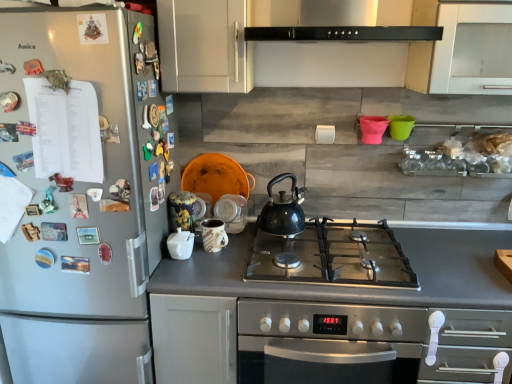
Question: From the image's perspective, is matte ceramic cups at center, the first appliance when ordered from back to front, located above or below white matte cabinet at upper center?

Choices:
 (A) above
 (B) below

Answer: (B)

Question: In the image, is matte ceramic cups at center, the 3th appliance positioned from the front, positioned in front of or behind white matte cabinet at upper center?

Choices:
 (A) behind
 (B) front

Answer: (A)

Question: Which object is positioned farthest from the black matte kettle at center?

Choices:
 (A) matte ceramic cups at center, the 3th appliance positioned from the front
 (B) stainless steel oven at center
 (C) satin silver refrigerator at left
 (D) white glossy sugar bowl at center, positioned as the third appliance in back-to-front order
 (E) matte ceramic mug at center, which is the 2th appliance from front to back

Answer: (C)

Question: Which is farther from the stainless steel oven at center?

Choices:
 (A) matte ceramic cups at center, the first appliance when ordered from back to front
 (B) black matte kettle at center
 (C) satin silver refrigerator at left
 (D) matte ceramic mug at center, which is counted as the second appliance, starting from the back
 (E) white glossy sugar bowl at center, marked as the first appliance in a front-to-back arrangement

Answer: (C)